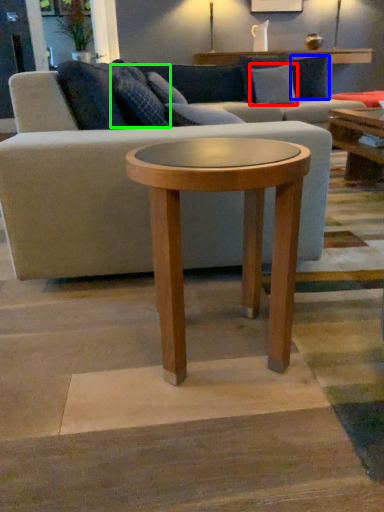
Question: Which object is the closest to the pillow (highlighted by a red box)? Choose among these: pillow (highlighted by a blue box) or pillow (highlighted by a green box).

Choices:
 (A) pillow
 (B) pillow

Answer: (A)